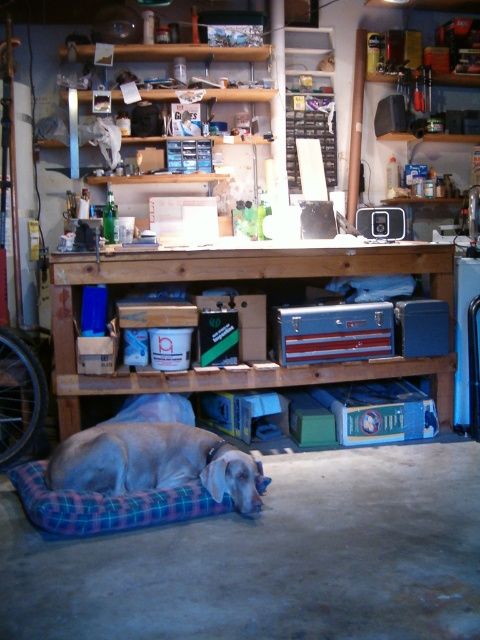
Can you confirm if gray fabric dog bed at lower left is positioned to the right of plaid fabric dog bed at lower center?

Correct, you'll find gray fabric dog bed at lower left to the right of plaid fabric dog bed at lower center.

Between gray fabric dog bed at lower left and plaid fabric dog bed at lower center, which one appears on the left side from the viewer's perspective?

plaid fabric dog bed at lower center is more to the left.

Image resolution: width=480 pixels, height=640 pixels. What do you see at coordinates (155, 461) in the screenshot?
I see `gray fabric dog bed at lower left` at bounding box center [155, 461].

Where is `gray fabric dog bed at lower left`? The image size is (480, 640). gray fabric dog bed at lower left is located at coordinates (155, 461).

Is metallic silver toolbox at center thinner than gray fabric dog bed at lower left?

In fact, metallic silver toolbox at center might be wider than gray fabric dog bed at lower left.

Is point (422, 246) positioned in front of point (157, 444)?

No, it is behind (157, 444).

The height and width of the screenshot is (640, 480). I want to click on metallic silver toolbox at center, so click(x=236, y=280).

Who is lower down, metallic silver toolbox at center or plaid fabric dog bed at lower center?

Positioned lower is plaid fabric dog bed at lower center.

Between point (72, 422) and point (33, 502), which one is positioned behind?

Point (72, 422)

This screenshot has width=480, height=640. What do you see at coordinates (236, 280) in the screenshot? I see `metallic silver toolbox at center` at bounding box center [236, 280].

Where is `metallic silver toolbox at center`? This screenshot has height=640, width=480. metallic silver toolbox at center is located at coordinates (236, 280).